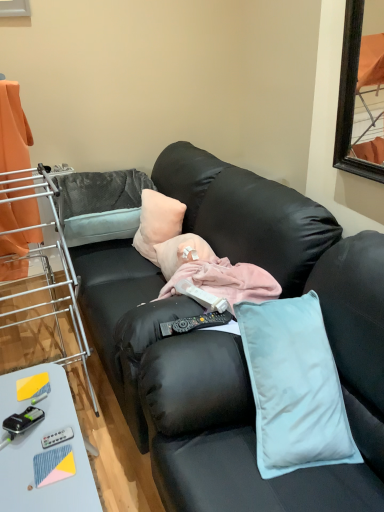
The width and height of the screenshot is (384, 512). Find the location of `empty space that is to the right of black plastic remote control at lower left, which ranks as the second equipment in right-to-left order`. empty space that is to the right of black plastic remote control at lower left, which ranks as the second equipment in right-to-left order is located at coordinates (58, 433).